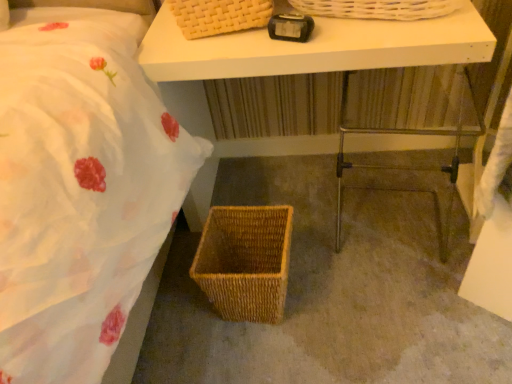
Question: Considering the relative sizes of black plastic alarm clock at upper center and brown woven basket at lower center in the image provided, is black plastic alarm clock at upper center taller than brown woven basket at lower center?

Choices:
 (A) yes
 (B) no

Answer: (A)

Question: Is black plastic alarm clock at upper center facing away from brown woven basket at lower center?

Choices:
 (A) no
 (B) yes

Answer: (A)

Question: Can you confirm if black plastic alarm clock at upper center is wider than brown woven basket at lower center?

Choices:
 (A) yes
 (B) no

Answer: (B)

Question: Does black plastic alarm clock at upper center contain brown woven basket at lower center?

Choices:
 (A) no
 (B) yes

Answer: (A)

Question: Does black plastic alarm clock at upper center appear on the left side of brown woven basket at lower center?

Choices:
 (A) no
 (B) yes

Answer: (B)

Question: Is point (358, 165) closer or farther from the camera than point (298, 139)?

Choices:
 (A) closer
 (B) farther

Answer: (A)

Question: Is metallic silver step stool at lower right situated inside white matte table at upper center or outside?

Choices:
 (A) inside
 (B) outside

Answer: (A)

Question: From a real-world perspective, is metallic silver step stool at lower right physically located above or below white matte table at upper center?

Choices:
 (A) below
 (B) above

Answer: (A)

Question: Is metallic silver step stool at lower right in front of or behind white matte table at upper center in the image?

Choices:
 (A) front
 (B) behind

Answer: (B)

Question: From the image's perspective, relative to metallic silver step stool at lower right, is woven brown picnic basket at lower center above or below?

Choices:
 (A) above
 (B) below

Answer: (B)

Question: In terms of size, does woven brown picnic basket at lower center appear bigger or smaller than metallic silver step stool at lower right?

Choices:
 (A) small
 (B) big

Answer: (A)

Question: Is woven brown picnic basket at lower center in front of or behind metallic silver step stool at lower right in the image?

Choices:
 (A) front
 (B) behind

Answer: (B)

Question: Looking at their shapes, would you say woven brown picnic basket at lower center is wider or thinner than metallic silver step stool at lower right?

Choices:
 (A) wide
 (B) thin

Answer: (B)

Question: From the image's perspective, relative to white matte table at upper center, is brown woven basket at lower center above or below?

Choices:
 (A) below
 (B) above

Answer: (A)

Question: In terms of height, does brown woven basket at lower center look taller or shorter compared to white matte table at upper center?

Choices:
 (A) short
 (B) tall

Answer: (A)